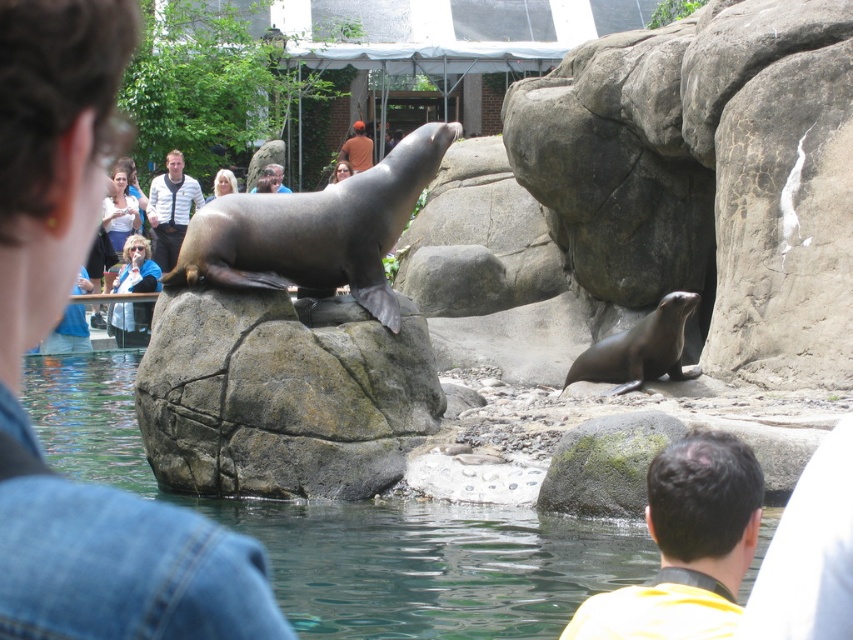
Is point (273, 540) less distant than point (727, 552)?

That is False.

From the picture: Is clear water at lower center taller than yellow fabric at center?

No, clear water at lower center is not taller than yellow fabric at center.

Who is more forward, [299,589] or [654,596]?

Positioned in front is point [654,596].

The image size is (853, 640). Find the location of `clear water at lower center`. clear water at lower center is located at coordinates (432, 564).

Who is more distant from viewer, (364, 564) or (369, 568)?

The point (364, 564) is more distant.

Who is higher up, transparent glass pool at center or clear water at lower center?

transparent glass pool at center is higher up.

Locate an element on the screen. transparent glass pool at center is located at coordinates (357, 531).

Who is more forward, (173,381) or (161,230)?

Point (173,381) is in front.

Who is positioned more to the right, gray rough rock at center or striped shirt at center?

Positioned to the right is gray rough rock at center.

Is point (209, 484) closer to camera compared to point (155, 179)?

Yes, it is.

Locate an element on the screen. The image size is (853, 640). gray rough rock at center is located at coordinates (282, 394).